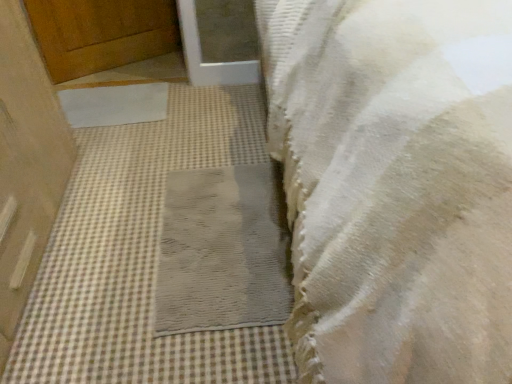
The image size is (512, 384). I want to click on free space between wooden door at left, positioned as the 1th door in bottom-to-top order, and white matte mat at center, the 2th mat in the front-to-back sequence, so point(101,179).